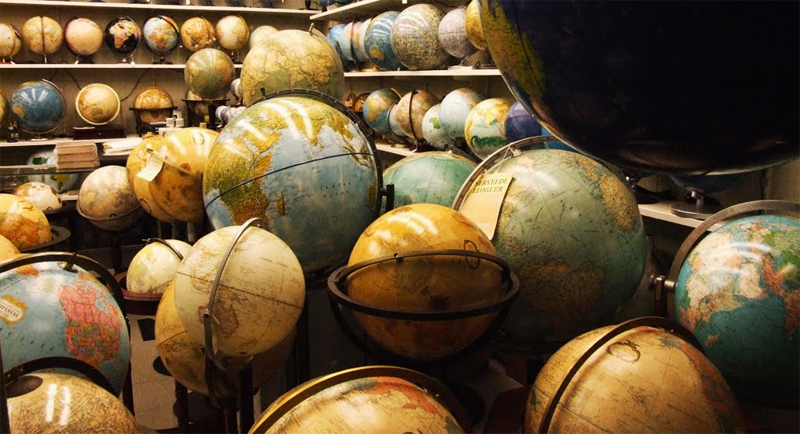
You are a GUI agent. You are given a task and a screenshot of the screen. Output one action in this format:
    pyautogui.click(x=<x>, y=<y>)
    Task: Click on the shelves
    This screenshot has height=434, width=800.
    Given the screenshot: What is the action you would take?
    pyautogui.click(x=210, y=6), pyautogui.click(x=161, y=61), pyautogui.click(x=118, y=154), pyautogui.click(x=381, y=146), pyautogui.click(x=402, y=71), pyautogui.click(x=354, y=2), pyautogui.click(x=682, y=220)